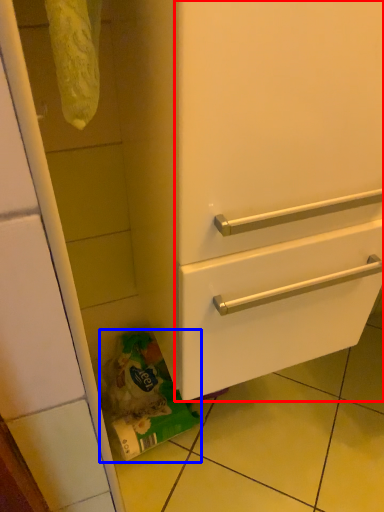
Question: Which of the following is the closest to the observer, door (highlighted by a red box) or garbage (highlighted by a blue box)?

Choices:
 (A) door
 (B) garbage

Answer: (A)